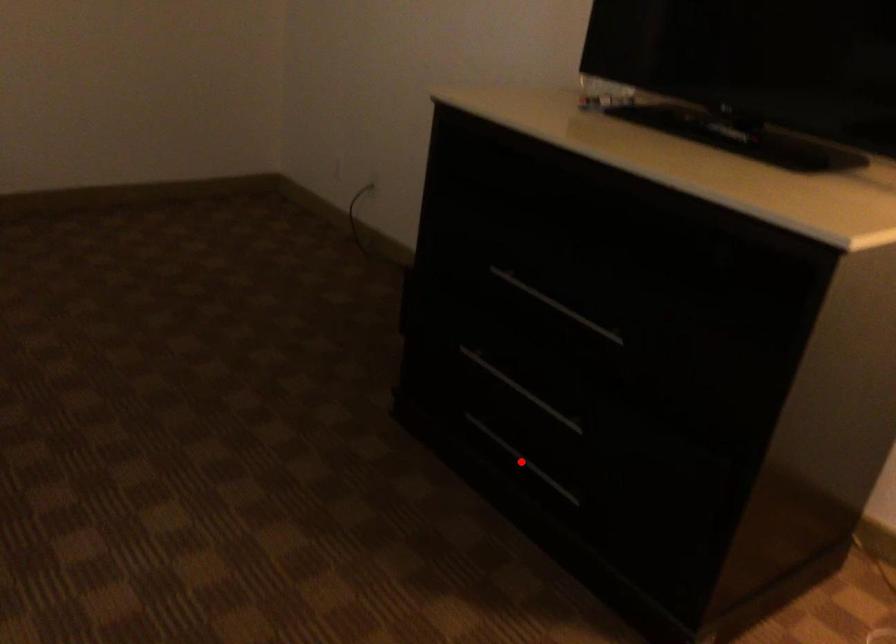
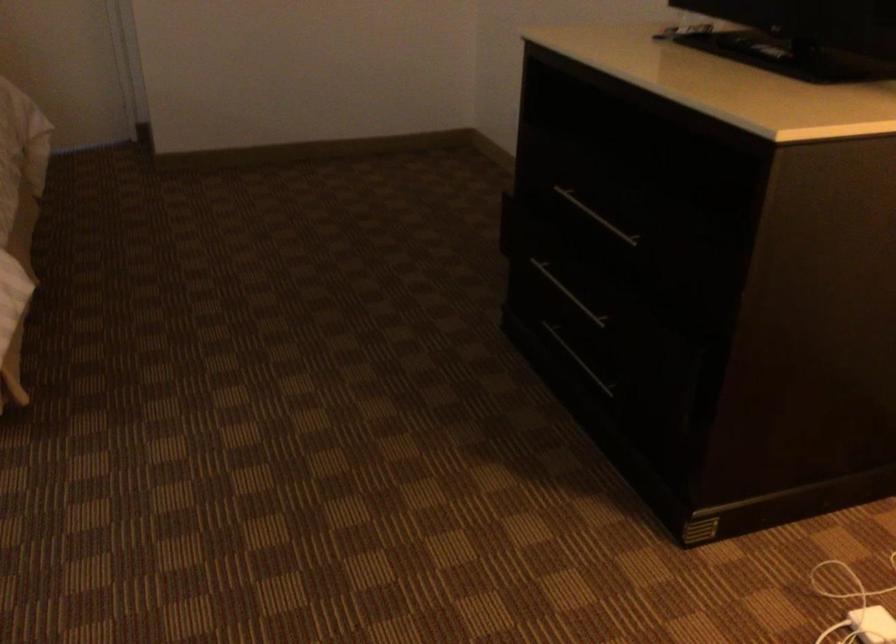
Locate, in the second image, the point that corresponds to the highlighted location in the first image.

(579, 360)